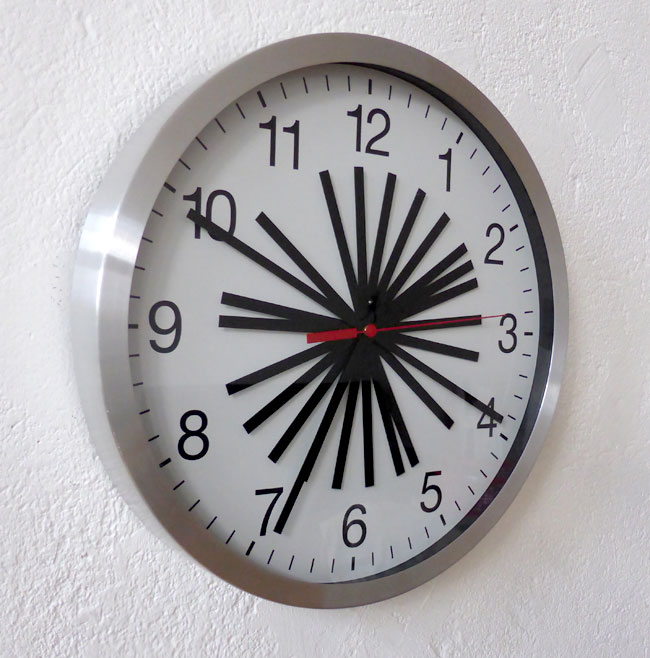
What are the coordinates of `metal frame` in the screenshot? It's located at (106, 330), (541, 408).